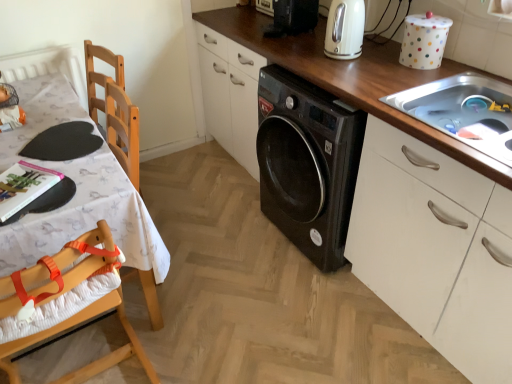
Identify the location of vacant area that is situated to the right of wooden highchair at left. (215, 340).